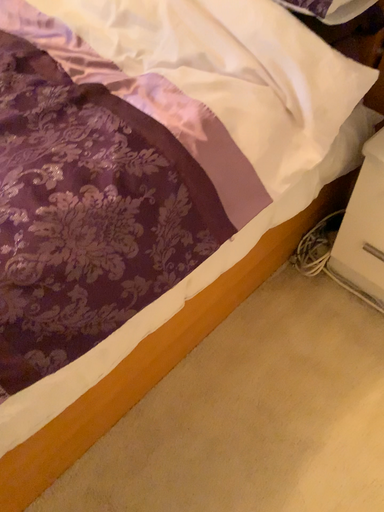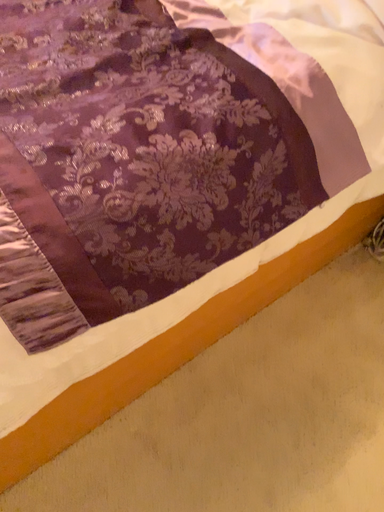
Question: How did the camera likely rotate when shooting the video?

Choices:
 (A) rotated right
 (B) rotated left

Answer: (B)